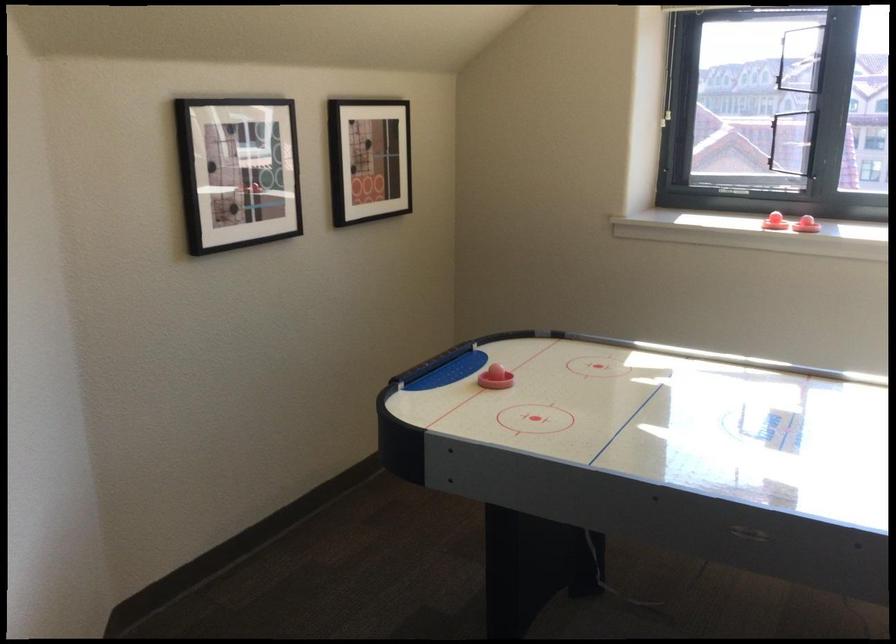
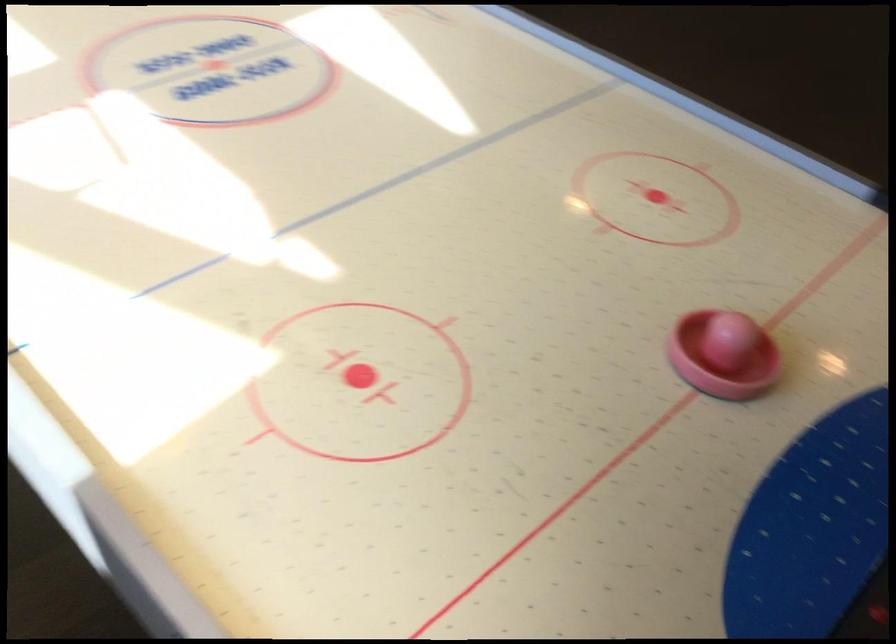
Find the pixel in the second image that matches the point at 463,370 in the first image.

(722, 355)